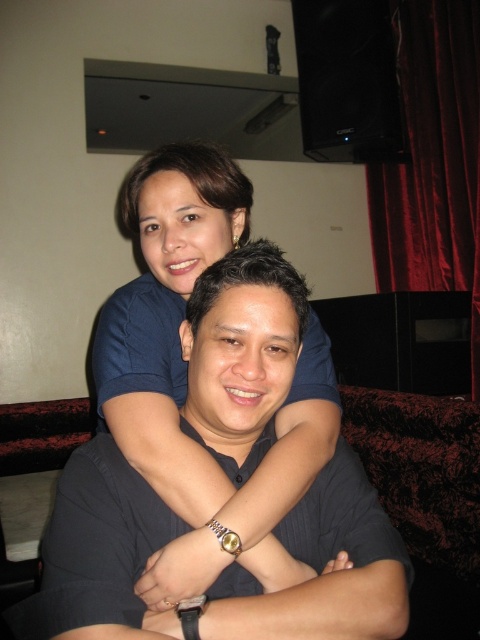
You are a photographer setting up a shoot in the living room. You need to position a light source between the blue smooth shirt at upper center and the velvet red curtain at upper right. Based on the scene description, can you place the light source between these two objects?

Answer: Yes, the blue smooth shirt at upper center is to the left of the velvet red curtain at upper right, so there is space between them to place the light source.

You are standing in front of the couch where the two individuals are seated. You need to place a small gift on the blue smooth shirt at upper center. Based on the coordinates provided, can you determine if the shirt is positioned to the left or right side of the couch?

The blue smooth shirt at upper center is located at coordinates point (x=186, y=378). Since the x coordinate is 0.592, which is closer to 1.0, the shirt is positioned to the right side of the couch.

You are a photographer standing at the entrance of the room. You need to take a photo of the blue smooth shirt at upper center and the velvet red curtain at upper right in the same frame. Given that your camera has a focal length of 50mm and a field of view of 46 degrees, will both objects be visible in the photo?

The blue smooth shirt at upper center is 7.80 feet away from the velvet red curtain at upper right. To determine if both are in the same frame, calculate the distance between them relative to the camera. If the 7.80 feet separation is within the 46 degree field of view at 50mm focal length, they can be captured. However, without knowing the exact camera position and angle, it is uncertain. The question lacks sufficient data for a definitive answer.